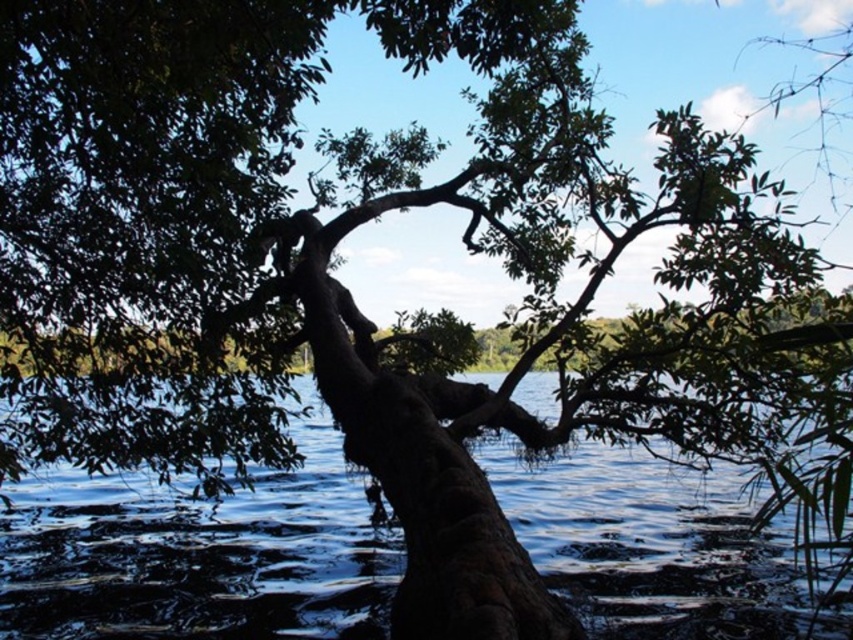
You are standing in the serene natural scene with the large tree. You notice two points marked in the image. Which point is closer to you, point 1 at coordinates (552, 403) or point 2 at coordinates (329, 234)?

Point 2 at coordinates (329, 234) is closer to you because it is less further to the viewer than point 1 at coordinates (552, 403).

You are a painter standing 3 meters away from the brown rough tree trunk at center. You want to paint the dark blue water at center without moving closer. Can you reach the water with your paintbrush?

The distance between the dark blue water at center and the brown rough tree trunk at center is 4.67 meters. Since you are already 3 meters away from the tree trunk, the total distance to the water is 4.67 meters. Therefore, you can reach the dark blue water at center with your paintbrush without moving closer.